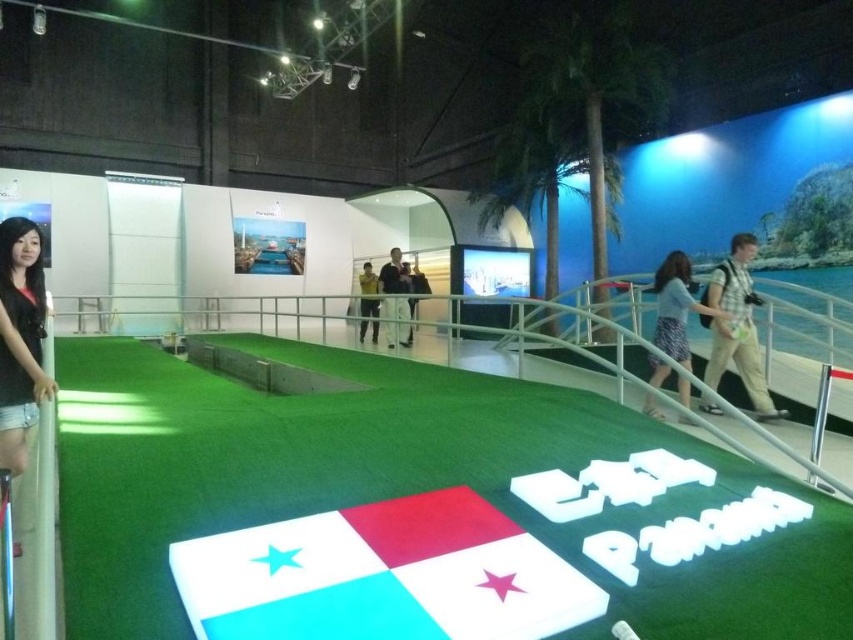
Question: Can you confirm if black denim shorts at lower left is thinner than yellow fabric jacket at center?

Choices:
 (A) yes
 (B) no

Answer: (A)

Question: Where is light blue fabric flag at center located in relation to plaid shirt at right in the image?

Choices:
 (A) left
 (B) right

Answer: (A)

Question: Which object is closer to the camera taking this photo?

Choices:
 (A) light brown fabric pants at center
 (B) yellow fabric jacket at center
 (C) plaid shirt at right

Answer: (C)

Question: Which point is closer to the camera?

Choices:
 (A) (335, 512)
 (B) (726, 316)
 (C) (722, 288)

Answer: (A)

Question: Which of these objects is positioned farthest from the light blue cotton dress at right?

Choices:
 (A) black denim shorts at lower left
 (B) light blue fabric flag at center

Answer: (A)

Question: Observing the image, what is the correct spatial positioning of light blue fabric flag at center in reference to light brown fabric pants at center?

Choices:
 (A) right
 (B) left

Answer: (A)